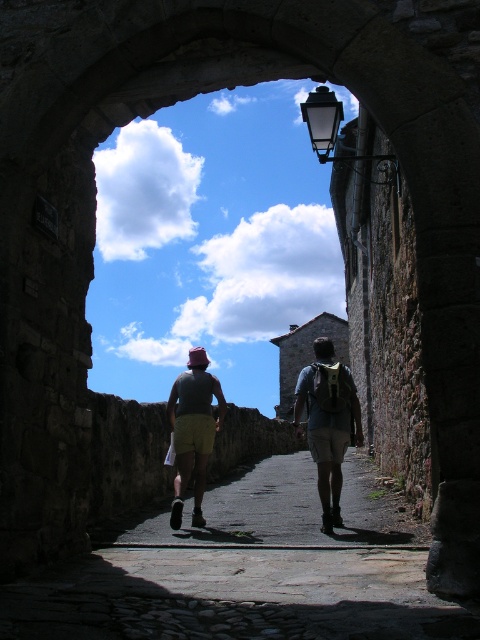
Question: Which point is farther to the camera?

Choices:
 (A) (326, 445)
 (B) (314, 388)

Answer: (B)

Question: Does gray fabric shorts at center have a lesser width compared to matte gray shirt at center?

Choices:
 (A) yes
 (B) no

Answer: (B)

Question: Does gray fabric shorts at center have a lesser width compared to matte gray backpack at center?

Choices:
 (A) no
 (B) yes

Answer: (A)

Question: Which point appears farthest from the camera in this image?

Choices:
 (A) (326, 516)
 (B) (316, 396)

Answer: (B)

Question: Does gray fabric shorts at center appear on the right side of matte gray shirt at center?

Choices:
 (A) no
 (B) yes

Answer: (B)

Question: Which object appears closest to the camera in this image?

Choices:
 (A) gray fabric shorts at center
 (B) matte gray shirt at center

Answer: (A)